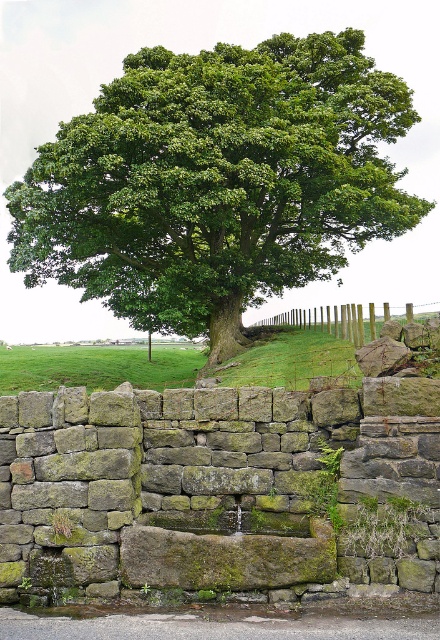
Question: Considering the real-world distances, which object is closest to the wooden posts at center?

Choices:
 (A) green leafy tree at upper center
 (B) green mossy stone at center

Answer: (B)

Question: Which point appears farthest from the camera in this image?

Choices:
 (A) [231, 240]
 (B) [355, 481]

Answer: (A)

Question: Is green mossy stone at center closer to the viewer compared to wooden posts at center?

Choices:
 (A) no
 (B) yes

Answer: (B)

Question: Is green mossy stone at center to the left of wooden posts at center from the viewer's perspective?

Choices:
 (A) yes
 (B) no

Answer: (A)

Question: Can you confirm if green leafy tree at upper center is positioned to the right of wooden posts at center?

Choices:
 (A) no
 (B) yes

Answer: (A)

Question: Which of these objects is positioned closest to the green leafy tree at upper center?

Choices:
 (A) green mossy stone at center
 (B) wooden posts at center

Answer: (B)